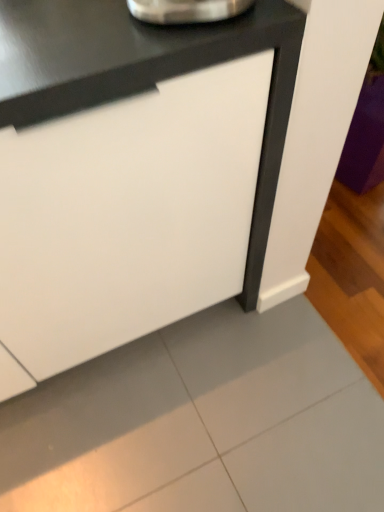
The height and width of the screenshot is (512, 384). What are the coordinates of `white matte cabinet at lower left` in the screenshot? It's located at (132, 172).

Describe the element at coordinates (132, 172) in the screenshot. I see `white matte cabinet at lower left` at that location.

Where is `white matte cabinet at lower left`? The width and height of the screenshot is (384, 512). white matte cabinet at lower left is located at coordinates (132, 172).